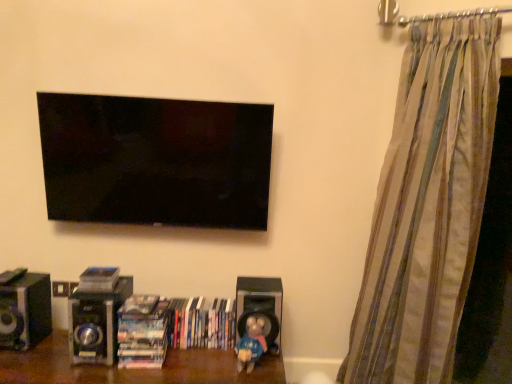
You are a GUI agent. You are given a task and a screenshot of the screen. Output one action in this format:
    pyautogui.click(x=<x>, y=<y>)
    Task: Click on the empty space that is to the right of hardcover books at center, the 2th book when ordered from right to left
    The image size is (512, 384).
    Given the screenshot: What is the action you would take?
    pyautogui.click(x=189, y=354)